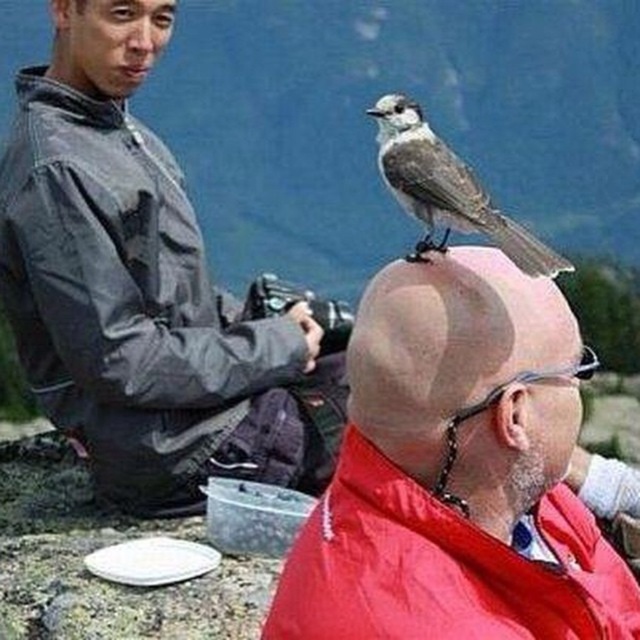
Which is below, matte gray jacket at left or gray matte bird at upper center?

matte gray jacket at left is lower down.

Can you confirm if matte gray jacket at left is positioned to the left of gray matte bird at upper center?

Indeed, matte gray jacket at left is positioned on the left side of gray matte bird at upper center.

The image size is (640, 640). Find the location of `matte gray jacket at left`. matte gray jacket at left is located at coordinates pyautogui.click(x=132, y=305).

Who is more forward, (563, 584) or (192, 298)?

Point (563, 584) is more forward.

Does point (480, 406) come farther from viewer compared to point (77, 140)?

No, (480, 406) is in front of (77, 140).

Where is `bald head at center`? The image size is (640, 640). bald head at center is located at coordinates (456, 472).

Does point (147, 472) come in front of point (84, 58)?

Yes, point (147, 472) is in front of point (84, 58).

Consider the image. Which is more to the right, matte gray jacket at left or smooth skin head at upper left?

matte gray jacket at left is more to the right.

Where is `matte gray jacket at left`? This screenshot has width=640, height=640. matte gray jacket at left is located at coordinates (132, 305).

Where is `matte gray jacket at left`? matte gray jacket at left is located at coordinates (132, 305).